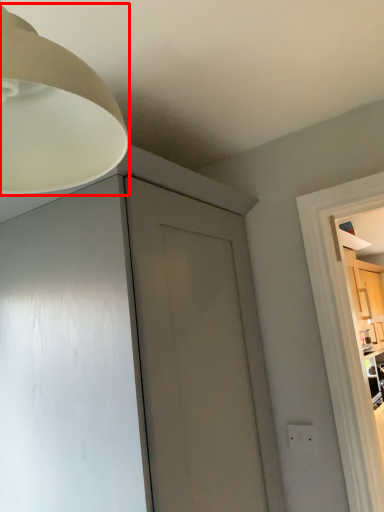
Question: From the image, what is the correct spatial relationship of lamp (annotated by the red box) in relation to electric outlet?

Choices:
 (A) right
 (B) left

Answer: (B)